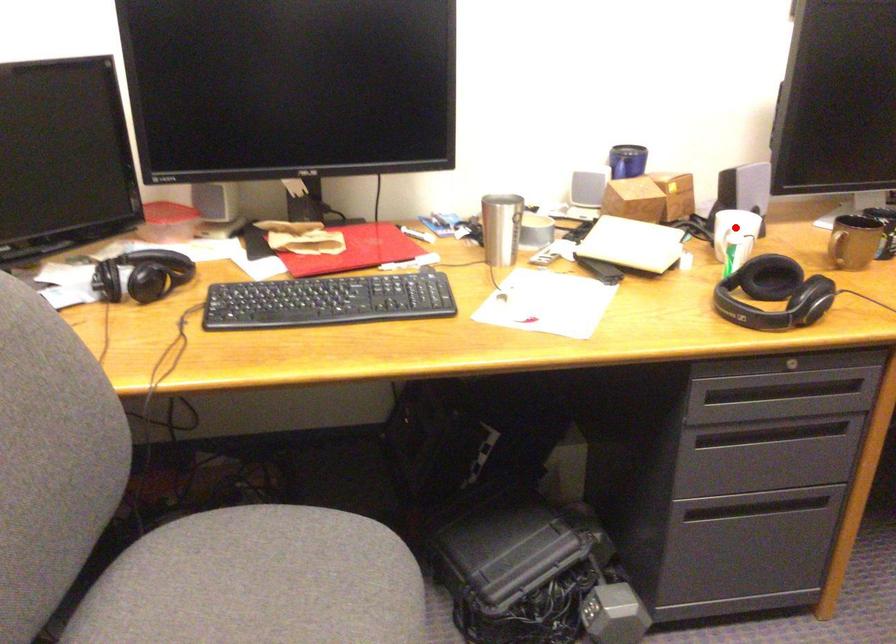
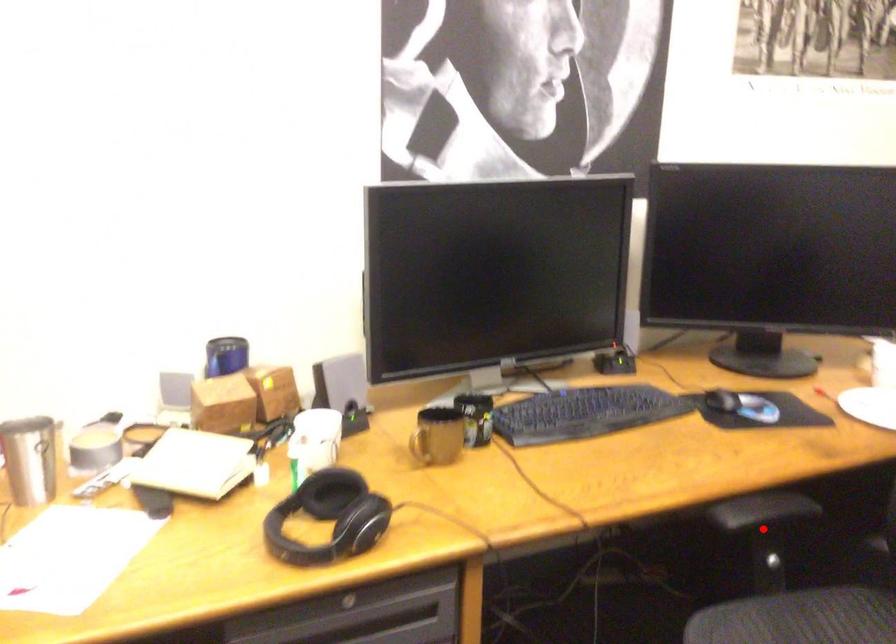
I am providing you with two images of the same scene from different viewpoints. A red point is marked on the first image and another point is marked on the second image. Does the point marked in image1 correspond to the same location as the one in image2?

No